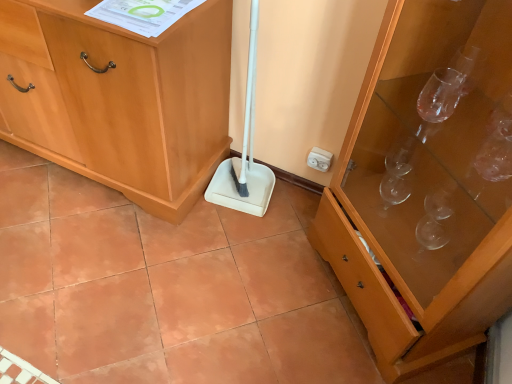
The width and height of the screenshot is (512, 384). What are the coordinates of `vacant area that is in front of white plastic shovel at center` in the screenshot? It's located at (233, 232).